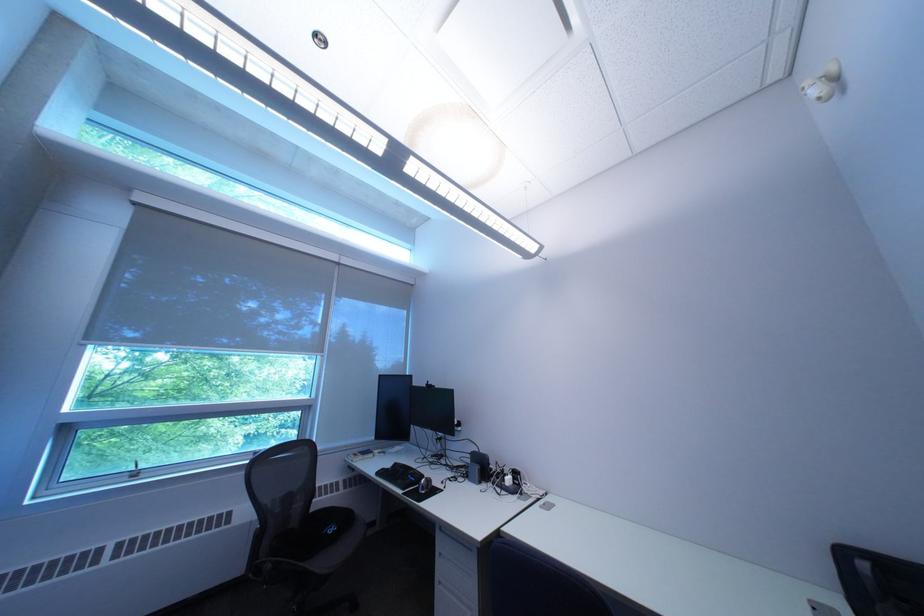
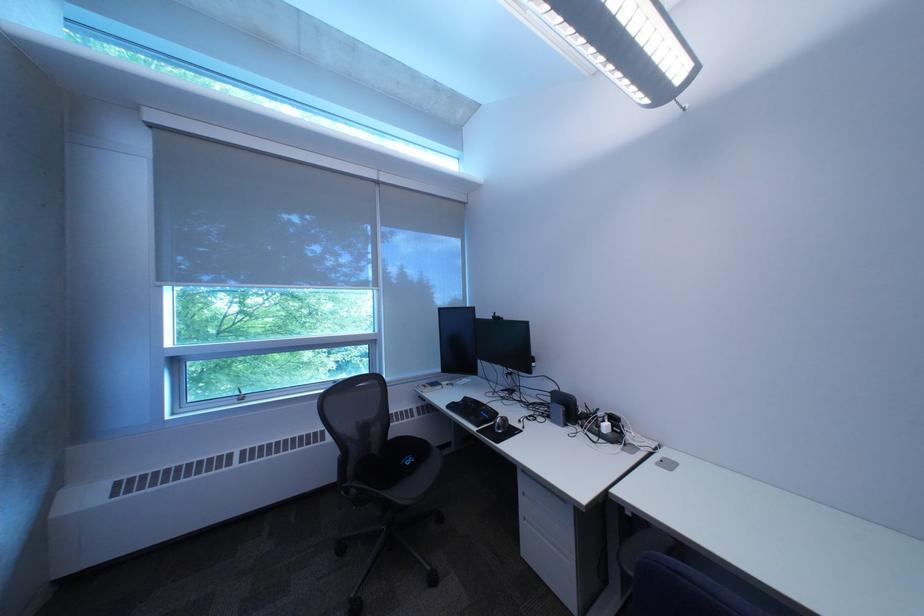
In the second image, find the point that corresponds to (346,530) in the first image.

(423, 461)